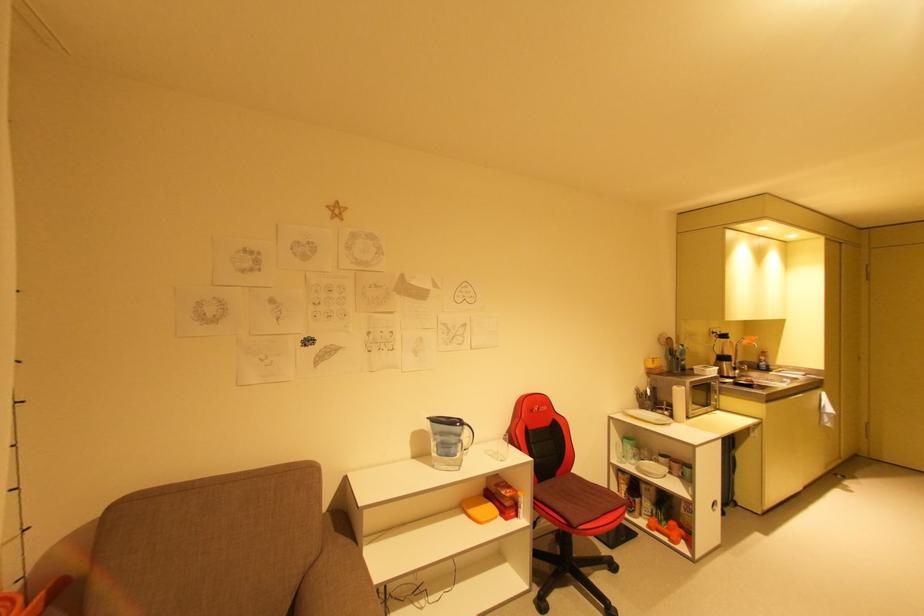
Describe the element at coordinates (576, 488) in the screenshot. The height and width of the screenshot is (616, 924). I see `a red chair sitting surface` at that location.